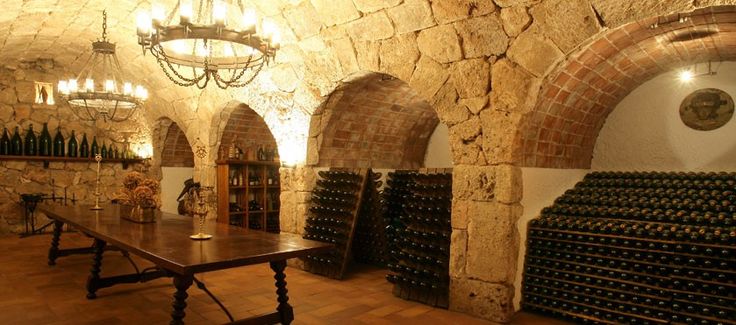
Locate an element on the screen. Image resolution: width=736 pixels, height=325 pixels. chandelier is located at coordinates (99, 95), (202, 31).